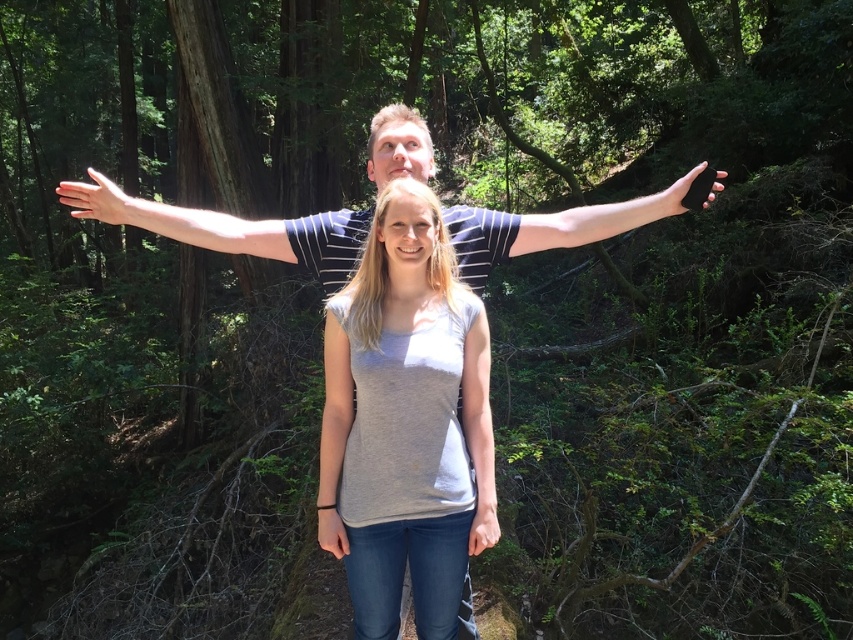
You are a photographer trying to focus on two points in the scene. The first point is point (125,211) and the second is point (102,212). Which point is closer to the camera?

Point (125,211) is further to the camera than point (102,212), so the second point is closer to the camera.

You are a photographer trying to capture the gray cotton tshirt at center in the image. The camera you are using has a focal point set at point (404, 419). Will the gray cotton tshirt at center be in focus?

Yes, the gray cotton tshirt at center is exactly at point (404, 419), so it will be in focus.

You are a photographer trying to capture a candid shot of the two people in the forest. You notice the black matte arm at upper right and the black matte phone at right. Which object should you avoid accidentally including in your frame to prevent blocking the subjects?

You should avoid including the black matte arm at upper right in your frame because it is closer to the viewer and might block the subjects more prominently than the black matte phone at right.